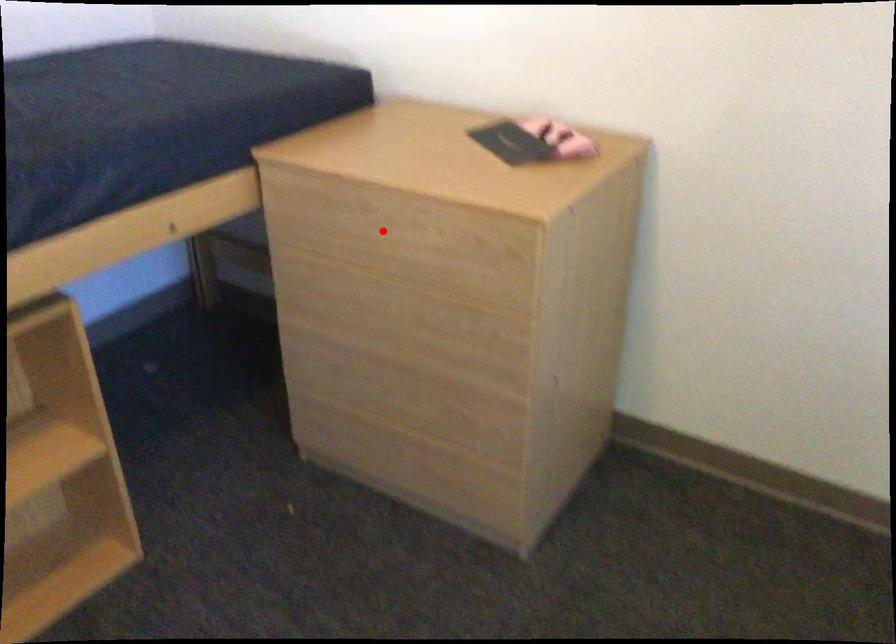
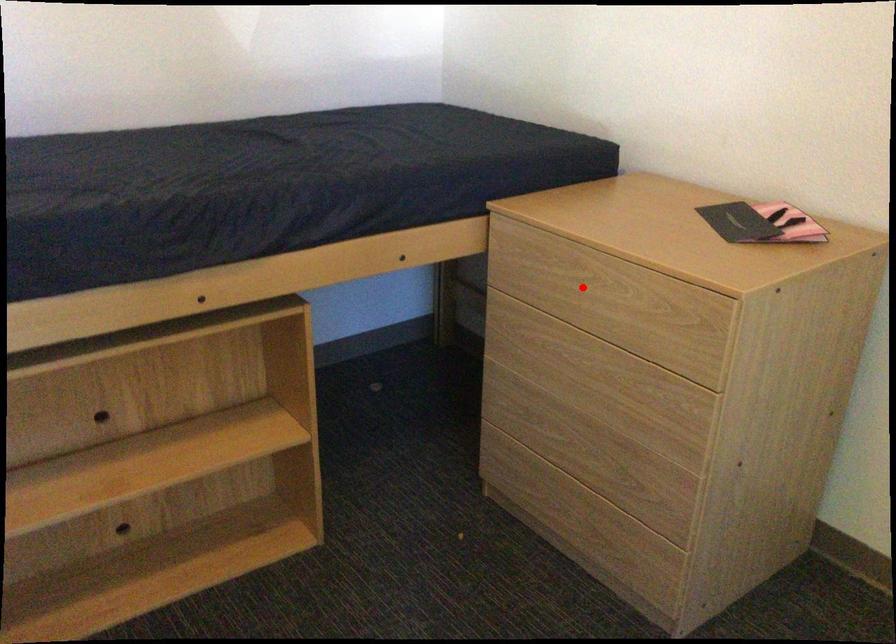
I am providing you with two images of the same scene from different viewpoints. A red point is marked on the first image and another point is marked on the second image. Does the point marked in image1 correspond to the same location as the one in image2?

Yes